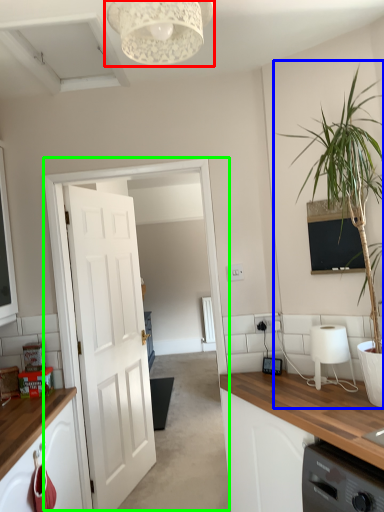
Question: Estimate the real-world distances between objects in this image. Which object is farther from light fixture (highlighted by a red box), houseplant (highlighted by a blue box) or glass door (highlighted by a green box)?

Choices:
 (A) houseplant
 (B) glass door

Answer: (B)